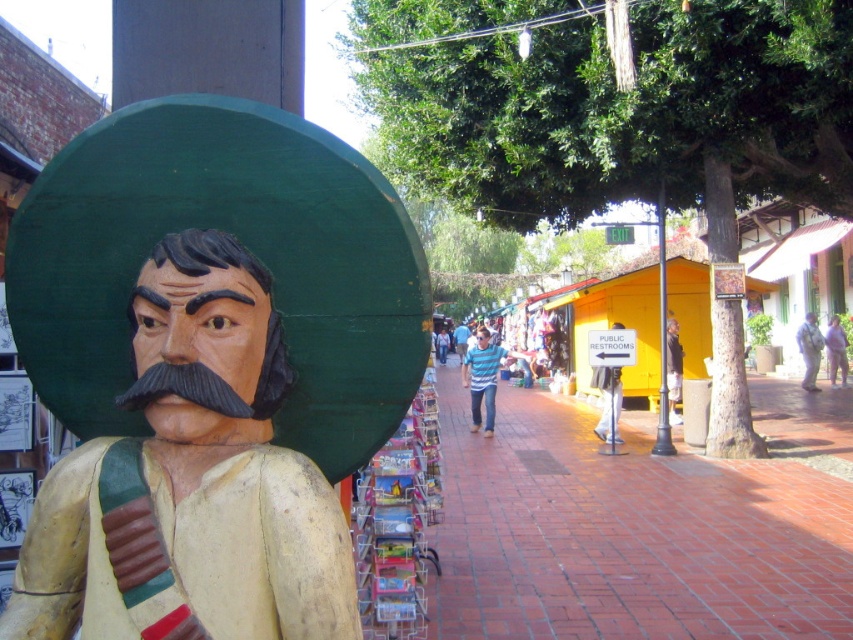
Who is more forward, (635, 540) or (805, 387)?

Point (635, 540) is in front.

Can you confirm if brick pavement at center is thinner than white fabric bag at center?

In fact, brick pavement at center might be wider than white fabric bag at center.

At what (x,y) coordinates should I click in order to perform the action: click on brick pavement at center. Please return your answer as a coordinate pair (x, y). The image size is (853, 640). Looking at the image, I should click on (619, 532).

Is dark gray fabric jacket at center bigger than white fabric bag at center?

No.

Which is in front, point (675, 378) or point (815, 349)?

Point (675, 378) is in front.

The image size is (853, 640). Describe the element at coordinates (672, 369) in the screenshot. I see `dark gray fabric jacket at center` at that location.

Image resolution: width=853 pixels, height=640 pixels. What are the coordinates of `dark gray fabric jacket at center` in the screenshot? It's located at (672, 369).

Who is positioned more to the right, wooden statue at left or striped cotton shirt at center?

striped cotton shirt at center is more to the right.

Identify the location of wooden statue at left. (210, 365).

Identify the location of wooden statue at left. This screenshot has height=640, width=853. click(210, 365).